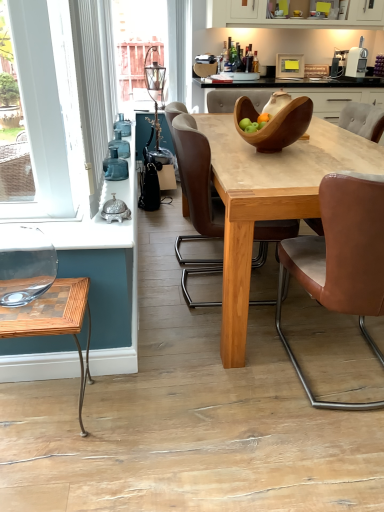
Question: In terms of height, does white matte cabinet at upper center look taller or shorter compared to brown leather chair at right, placed as the 3th chair when sorted from left to right?

Choices:
 (A) short
 (B) tall

Answer: (A)

Question: Is point (223, 8) closer or farther from the camera than point (380, 114)?

Choices:
 (A) closer
 (B) farther

Answer: (B)

Question: Which object is the farthest from the white textured curtain at left?

Choices:
 (A) white plastic toaster at upper right
 (B) brown leather chair at center, placed as the 1th chair when sorted from left to right
 (C) brown leather chair at center, which appears as the 2th chair when viewed from the left
 (D) wooden bowl at center
 (E) natural wood table at center

Answer: (A)

Question: Which object is positioned closest to the white textured curtain at left?

Choices:
 (A) wooden bowl at center
 (B) wooden checkered coffee table at lower left
 (C) white plastic toaster at upper right
 (D) white matte cabinet at upper center
 (E) brown leather chair at right, placed as the 3th chair when sorted from left to right

Answer: (B)